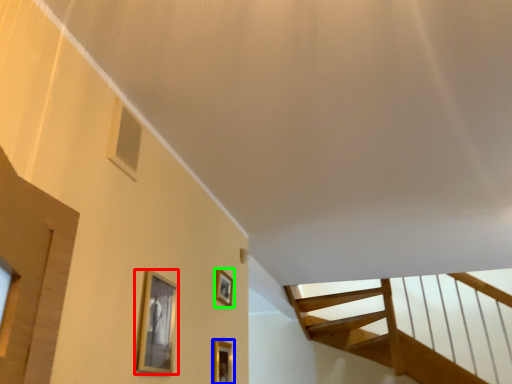
Question: Which object is the closest to the picture frame (highlighted by a red box)? Choose among these: picture frame (highlighted by a blue box) or picture frame (highlighted by a green box).

Choices:
 (A) picture frame
 (B) picture frame

Answer: (A)